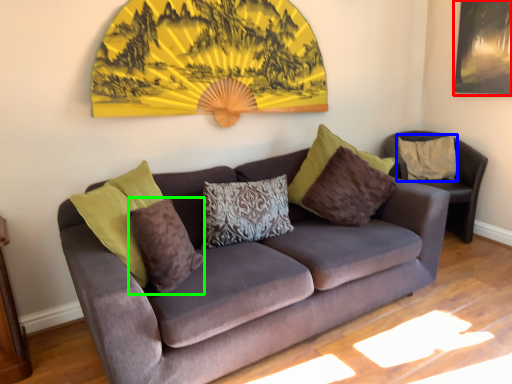
Question: Estimate the real-world distances between objects in this image. Which object is farther from picture frame (highlighted by a red box), pillow (highlighted by a blue box) or pillow (highlighted by a green box)?

Choices:
 (A) pillow
 (B) pillow

Answer: (B)